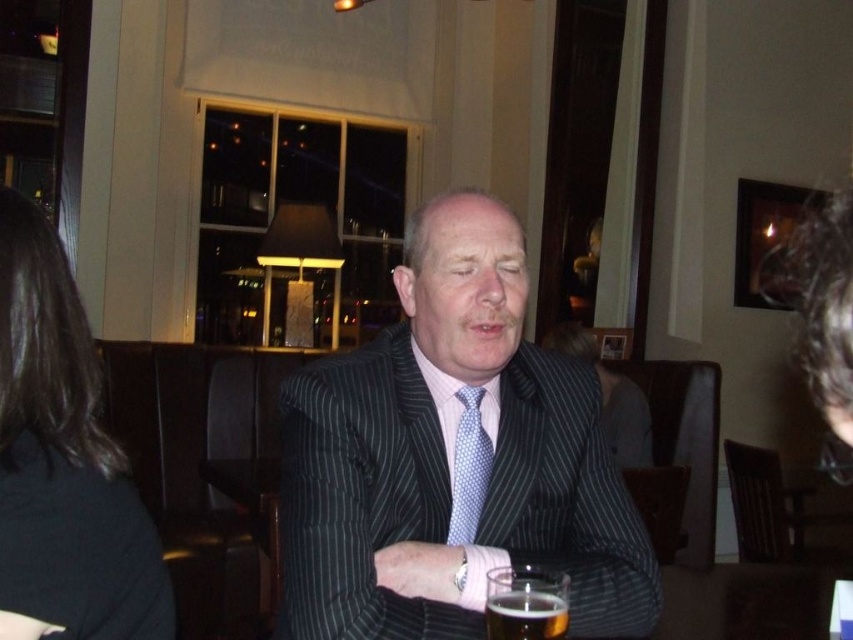
You are a waiter in a restaurant. You need to determine which item is smaller between the clear glass at lower center and the blue dotted tie at center. Which one is smaller?

The clear glass at lower center has a smaller size compared to the blue dotted tie at center, so the clear glass at lower center is smaller.

You are a waiter in a restaurant. You need to place a menu that is 12 inches long on the table between the clear glass at lower center and the blue dotted tie at center. Is there enough space between them to fit the menu without moving either object?

The clear glass at lower center and blue dotted tie at center are 13.28 inches apart from each other. Since the menu is 12 inches long, there is enough space to place it between them without moving either object.

You are a waiter in a restaurant. You need to place a small note on the table so that it is between the black fabric hair at left and the blue dotted tie at center. Where should you position the note?

The black fabric hair at left is above the blue dotted tie at center, so you should place the note between them by positioning it below the black fabric hair at left and above the blue dotted tie at center.